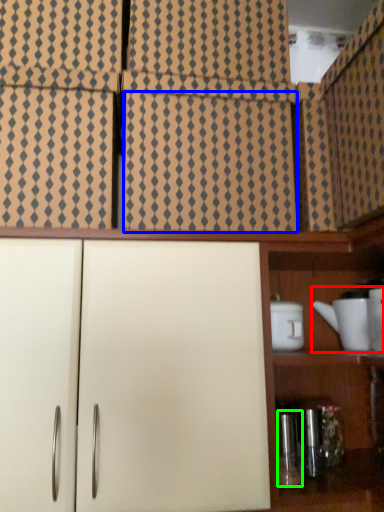
Question: Estimate the real-world distances between objects in this image. Which object is farther from tea set (highlighted by a red box), tile (highlighted by a blue box) or bottle (highlighted by a green box)?

Choices:
 (A) tile
 (B) bottle

Answer: (A)